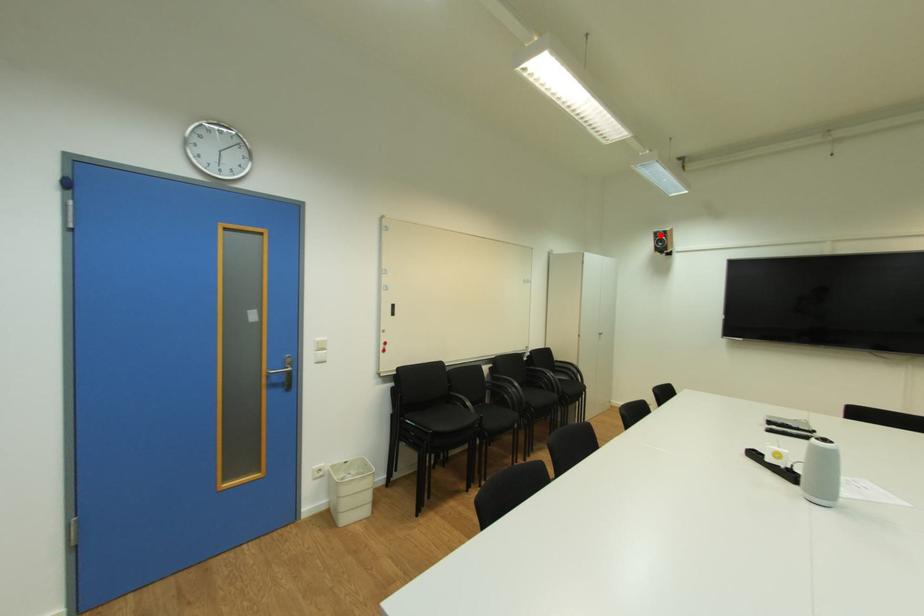
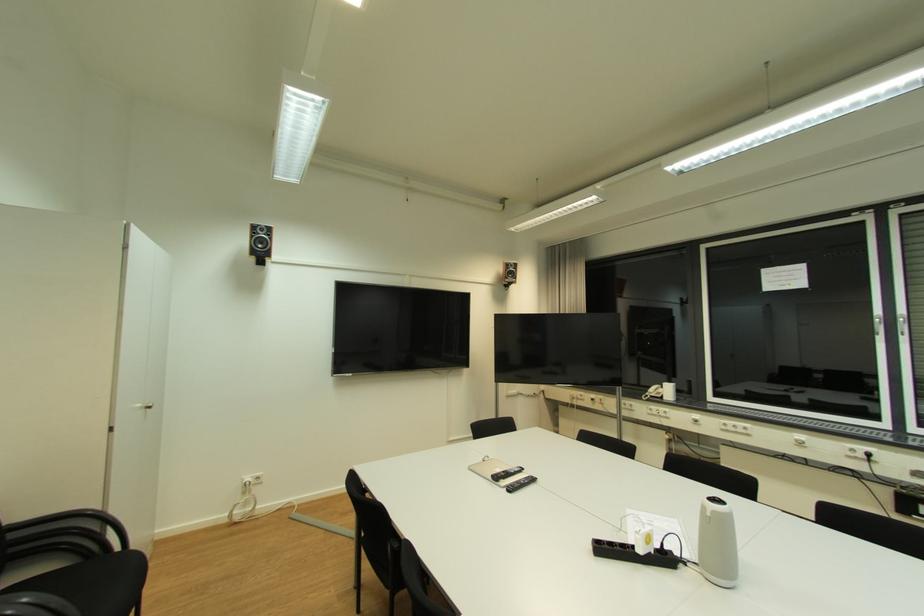
Locate, in the second image, the point that corresponds to the highlighted location in the first image.

(261, 228)